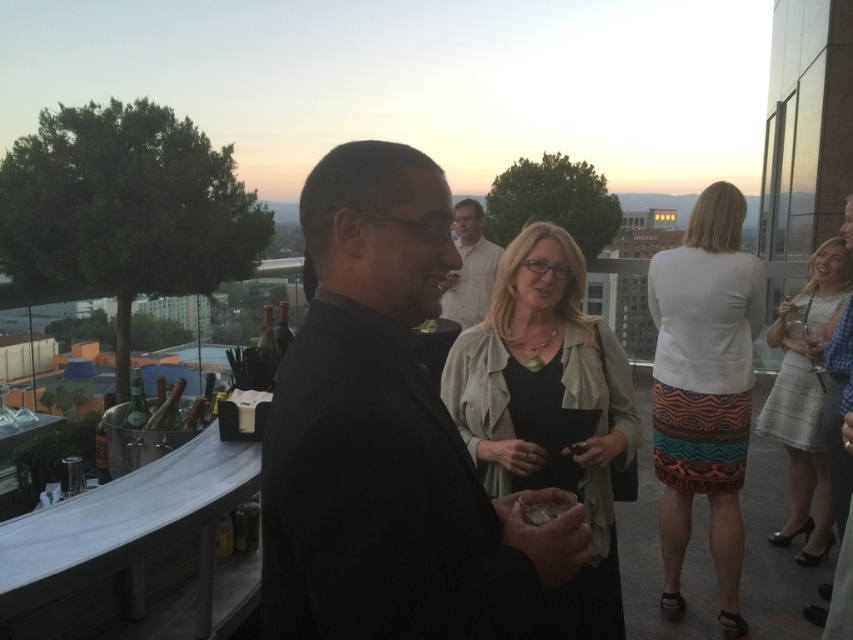
Question: Can you confirm if white matte skirt at upper right is smaller than light gray textured skirt at right?

Choices:
 (A) yes
 (B) no

Answer: (B)

Question: Is matte beige jacket at center positioned at the back of white cotton shirt at center?

Choices:
 (A) yes
 (B) no

Answer: (B)

Question: Does matte beige jacket at center have a smaller size compared to light gray textured skirt at right?

Choices:
 (A) yes
 (B) no

Answer: (A)

Question: Which object is farther from the camera taking this photo?

Choices:
 (A) black matte suit at center
 (B) white matte skirt at upper right
 (C) matte beige jacket at center

Answer: (B)

Question: Which point is closer to the camera?

Choices:
 (A) pos(838,292)
 (B) pos(459,316)

Answer: (A)

Question: Which object is the farthest from the black matte suit at center?

Choices:
 (A) matte beige jacket at center
 (B) light gray textured skirt at right
 (C) white matte skirt at upper right
 (D) white cotton shirt at center

Answer: (B)